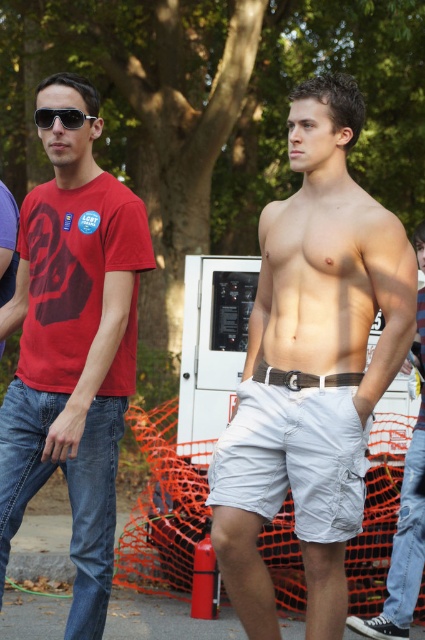
Can you confirm if light beige cotton shorts at center is bigger than white cotton shorts at center?

Yes.

Who is higher up, light beige cotton shorts at center or white cotton shorts at center?

light beige cotton shorts at center

Is point (342, 97) farther from viewer compared to point (314, 467)?

Yes.

Find the location of a particular element. The image size is (425, 640). light beige cotton shorts at center is located at coordinates (311, 365).

Is light beige cotton shorts at center taller than matte red t-shirt at left?

Correct, light beige cotton shorts at center is much taller as matte red t-shirt at left.

Does point (263, 513) come behind point (68, 150)?

That is False.

Identify the location of light beige cotton shorts at center. (311, 365).

Who is taller, light beige shorts at center or black plastic sunglasses at upper left?

light beige shorts at center

Is point (404, 624) closer to viewer compared to point (76, 113)?

No, it is behind (76, 113).

Locate an element on the screen. light beige shorts at center is located at coordinates (404, 547).